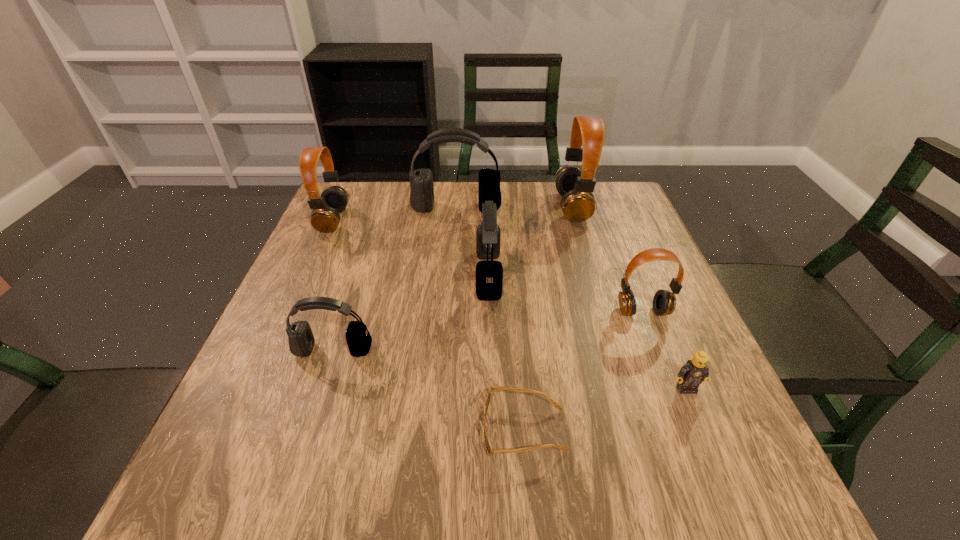
Where is `free space located on the ear cups of the nearest brown headset`? This screenshot has width=960, height=540. free space located on the ear cups of the nearest brown headset is located at coordinates (698, 454).

Image resolution: width=960 pixels, height=540 pixels. I want to click on vacant point located 0.130m on the headband of the sixth farthest object, so click(311, 420).

Where is `vacant area situated in front of the second nearest object`? The width and height of the screenshot is (960, 540). vacant area situated in front of the second nearest object is located at coordinates (706, 435).

You are a GUI agent. You are given a task and a screenshot of the screen. Output one action in this format:
    pyautogui.click(x=<x>, y=<y>)
    Task: Click on the blank space located 0.310m on the front-facing side of the shortest object
    
    Given the screenshot: What is the action you would take?
    pyautogui.click(x=298, y=430)

This screenshot has width=960, height=540. I want to click on vacant space located 0.350m on the front-facing side of the shortest object, so click(274, 430).

The image size is (960, 540). What are the coordinates of `vacant space situated 0.080m on the front-facing side of the shortest object` in the screenshot? It's located at (436, 430).

Locate an element on the screen. This screenshot has height=540, width=960. object that is at the near edge is located at coordinates (490, 451).

Where is `Lego at the right edge`? Lego at the right edge is located at coordinates (691, 374).

Locate an element on the screen. The height and width of the screenshot is (540, 960). object that is positioned at the far left corner is located at coordinates (325, 217).

Identify the location of object that is at the far right corner. (575, 185).